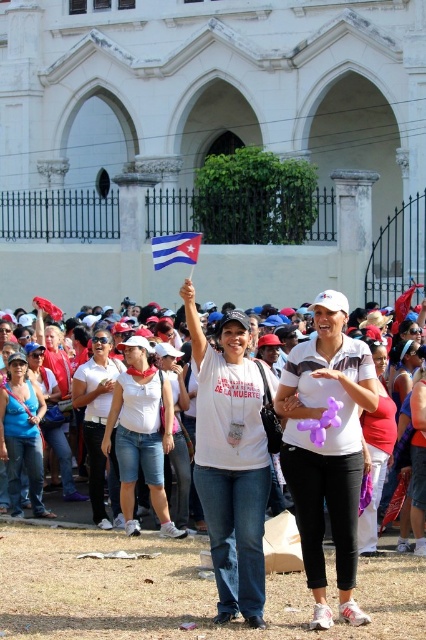
Does white matte balloon animal at center lie behind white cotton t-shirt at center?

That is False.

Between point (339, 321) and point (374, 403), which one is positioned in front?

Point (374, 403) is in front.

This screenshot has width=426, height=640. What are the coordinates of `white matte balloon animal at center` in the screenshot? It's located at (327, 449).

Is white cotton shirt at center closer to the viewer compared to matte white tank top at center?

No, white cotton shirt at center is further to the viewer.

Between white cotton shirt at center and matte white tank top at center, which one is positioned lower?

Positioned lower is white cotton shirt at center.

Where is `white cotton shirt at center`? Image resolution: width=426 pixels, height=640 pixels. white cotton shirt at center is located at coordinates (98, 422).

Which of these two, white matte balloon animal at center or white cotton shirt at center, stands taller?

white matte balloon animal at center

Is white matte balloon animal at center shorter than white cotton shirt at center?

Incorrect, white matte balloon animal at center's height does not fall short of white cotton shirt at center's.

In the scene shown: Who is more distant from viewer, (301, 449) or (89, 368)?

The point (89, 368) is more distant.

Find the location of a particular element. This screenshot has width=426, height=640. white matte balloon animal at center is located at coordinates (327, 449).